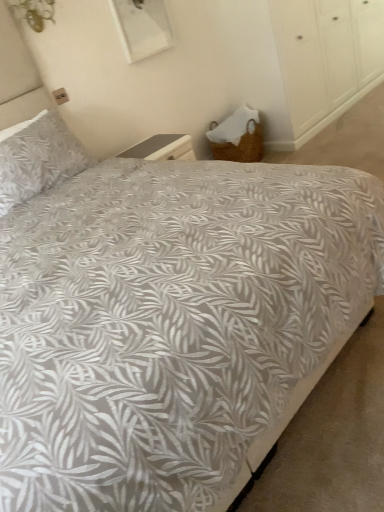
Question: Should I look upward or downward to see woven wicker basket at lower right?

Choices:
 (A) down
 (B) up

Answer: (B)

Question: Is woven wicker basket at lower right positioned behind gray leaf-patterned pillow at upper left?

Choices:
 (A) yes
 (B) no

Answer: (A)

Question: Is woven wicker basket at lower right looking in the opposite direction of gray leaf-patterned pillow at upper left?

Choices:
 (A) no
 (B) yes

Answer: (A)

Question: Is woven wicker basket at lower right surrounding gray leaf-patterned pillow at upper left?

Choices:
 (A) yes
 (B) no

Answer: (B)

Question: Does woven wicker basket at lower right have a lesser height compared to gray leaf-patterned pillow at upper left?

Choices:
 (A) no
 (B) yes

Answer: (A)

Question: Does woven wicker basket at lower right have a lesser width compared to gray leaf-patterned pillow at upper left?

Choices:
 (A) yes
 (B) no

Answer: (B)

Question: Is woven wicker basket at lower right next to gray leaf-patterned pillow at upper left and touching it?

Choices:
 (A) yes
 (B) no

Answer: (B)

Question: Does gray leaf-patterned pillow at upper left have a lesser height compared to woven wicker basket at lower right?

Choices:
 (A) no
 (B) yes

Answer: (B)

Question: Does gray leaf-patterned pillow at upper left lie behind woven wicker basket at lower right?

Choices:
 (A) yes
 (B) no

Answer: (B)

Question: From the image's perspective, is gray leaf-patterned pillow at upper left beneath woven wicker basket at lower right?

Choices:
 (A) no
 (B) yes

Answer: (B)

Question: Is gray leaf-patterned pillow at upper left positioned before woven wicker basket at lower right?

Choices:
 (A) no
 (B) yes

Answer: (B)

Question: Can you confirm if gray leaf-patterned pillow at upper left is smaller than woven wicker basket at lower right?

Choices:
 (A) no
 (B) yes

Answer: (B)

Question: Is gray leaf-patterned pillow at upper left thinner than woven wicker basket at lower right?

Choices:
 (A) yes
 (B) no

Answer: (A)

Question: From the image's perspective, relative to gray leaf-patterned pillow at upper left, is woven wicker basket at lower right above or below?

Choices:
 (A) below
 (B) above

Answer: (B)